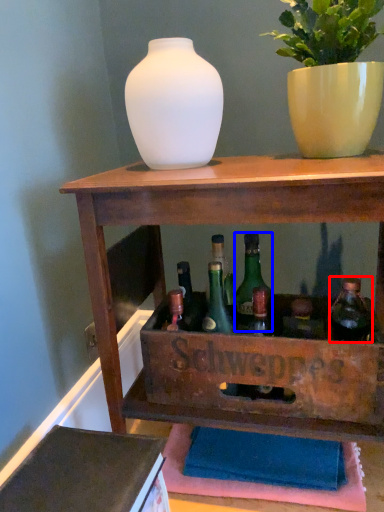
Question: Among these objects, which one is farthest to the camera, bottle (highlighted by a red box) or glass bottle (highlighted by a blue box)?

Choices:
 (A) bottle
 (B) glass bottle

Answer: (B)